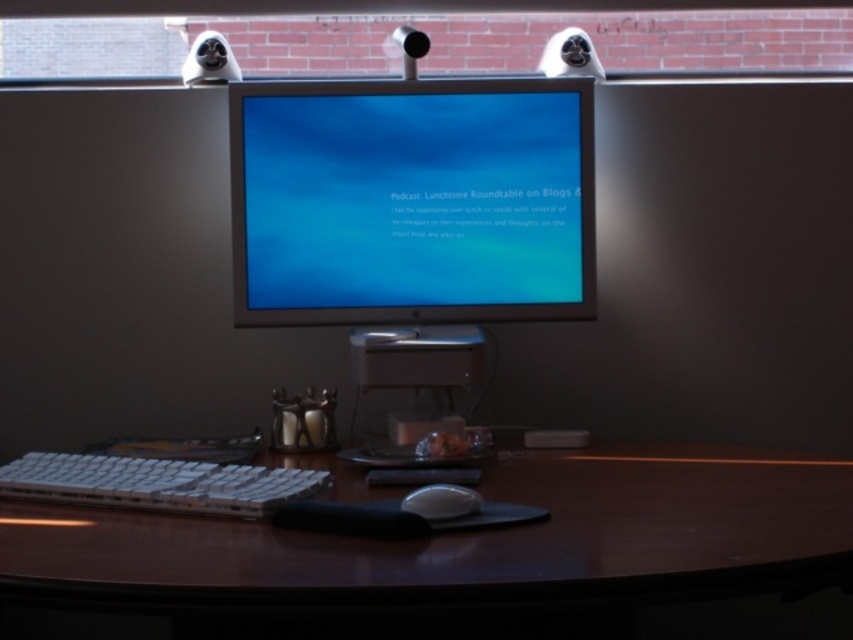
Question: Does satin silver monitor at center appear under white plastic keyboard at lower left?

Choices:
 (A) no
 (B) yes

Answer: (A)

Question: Does brown wood table at center come behind white matte mouse at center?

Choices:
 (A) yes
 (B) no

Answer: (B)

Question: Which point is farther to the camera?

Choices:
 (A) (306, 106)
 (B) (459, 504)
 (C) (827, 483)
 (D) (136, 461)

Answer: (A)

Question: Estimate the real-world distances between objects in this image. Which object is closer to the white matte mouse at center?

Choices:
 (A) satin silver monitor at center
 (B) white plastic keyboard at lower left
 (C) brown wood table at center

Answer: (C)

Question: Which point is farther from the camera taking this photo?

Choices:
 (A) pyautogui.click(x=270, y=496)
 (B) pyautogui.click(x=434, y=486)
 (C) pyautogui.click(x=349, y=266)

Answer: (C)

Question: Is satin silver monitor at center to the left of white matte mouse at center from the viewer's perspective?

Choices:
 (A) no
 (B) yes

Answer: (B)